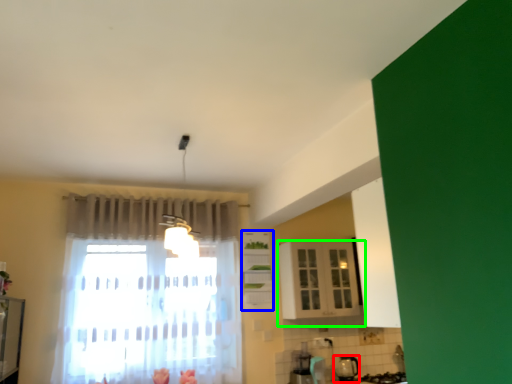
Question: Which object is positioned closest to appliance (highlighted by a red box)? Select from cabinetry (highlighted by a blue box) and cabinetry (highlighted by a green box).

Choices:
 (A) cabinetry
 (B) cabinetry

Answer: (B)